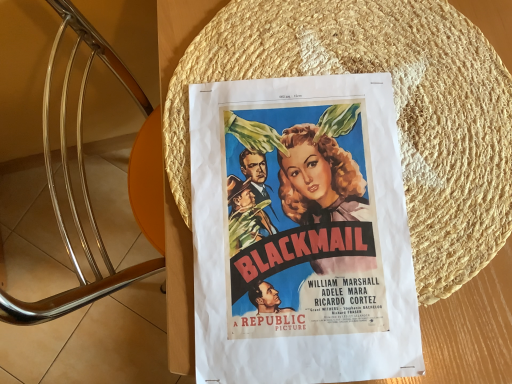
Where is `free space above woven straw hat at center (from a real-world perspective)`? This screenshot has height=384, width=512. free space above woven straw hat at center (from a real-world perspective) is located at coordinates (355, 127).